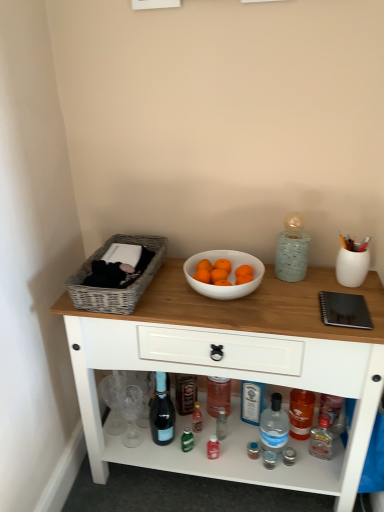
Where is `space that is in front of white glossy bowl at center`? space that is in front of white glossy bowl at center is located at coordinates (235, 316).